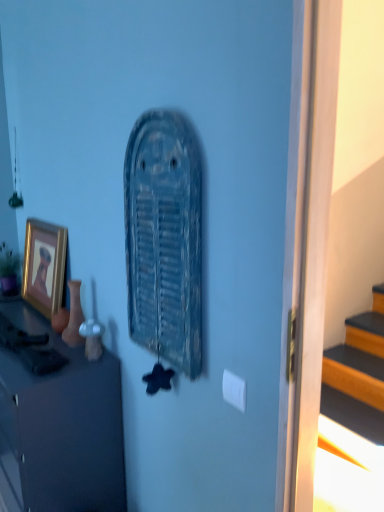
Question: Considering the relative positions of rusty metal vent at center and gold-framed picture at left in the image provided, is rusty metal vent at center to the left or to the right of gold-framed picture at left?

Choices:
 (A) right
 (B) left

Answer: (A)

Question: Is rusty metal vent at center in front of or behind gold-framed picture at left in the image?

Choices:
 (A) front
 (B) behind

Answer: (A)

Question: Estimate the real-world distances between objects in this image. Which object is closer to the gold-framed picture at left?

Choices:
 (A) green matte houseplant at left
 (B) rusty metal vent at center
 (C) matte black cabinet at left

Answer: (A)

Question: Which object is positioned closest to the rusty metal vent at center?

Choices:
 (A) green matte houseplant at left
 (B) matte black cabinet at left
 (C) gold-framed picture at left

Answer: (B)